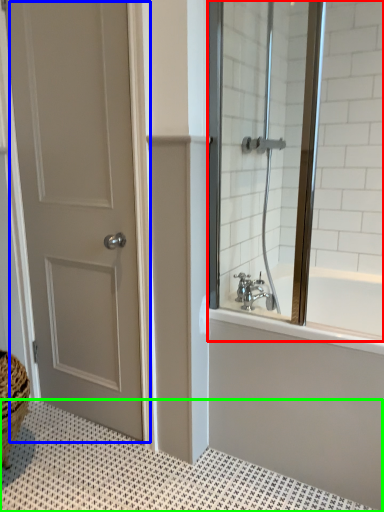
Question: Which is farther away from window screen (highlighted by a red box)? door (highlighted by a blue box) or bath mat (highlighted by a green box)?

Choices:
 (A) door
 (B) bath mat

Answer: (B)